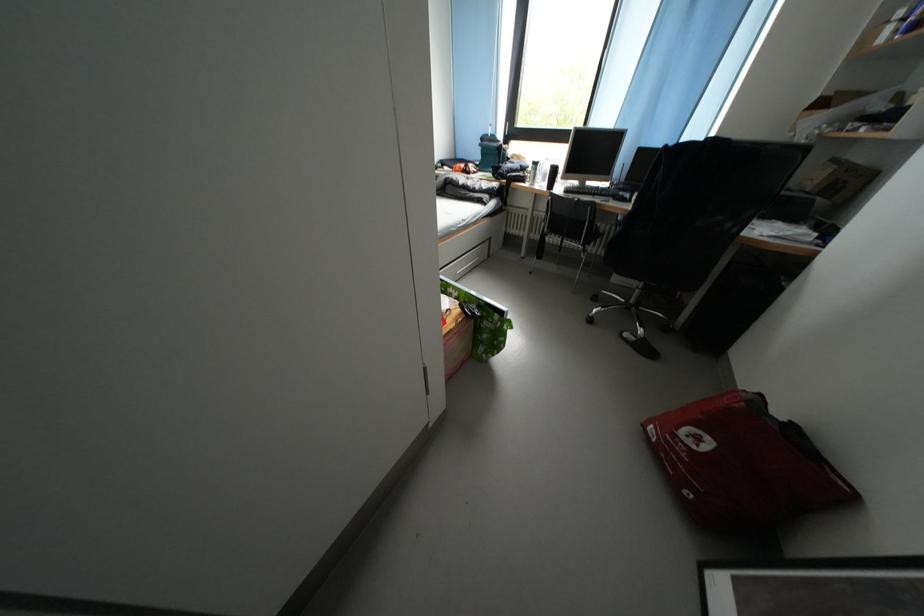
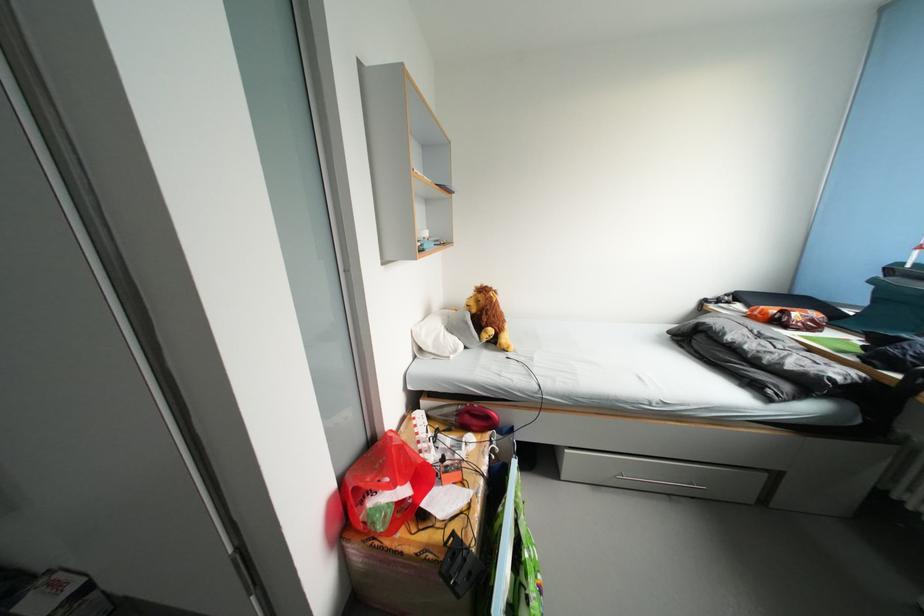
Find the pixel in the second image that matches pixel 471 321 in the first image.

(450, 562)